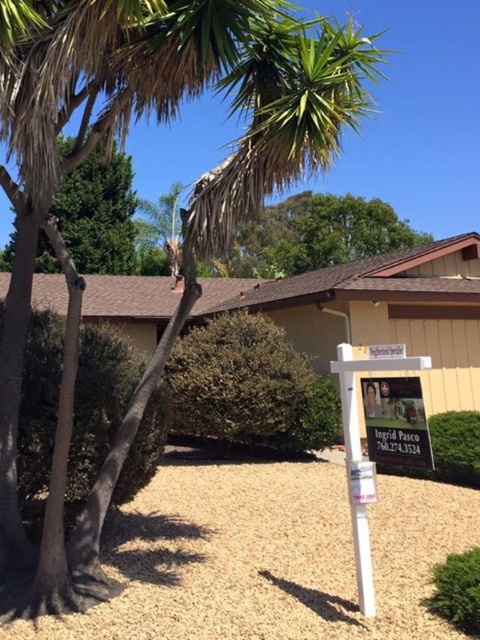
Question: Is green leafy bush at center closer to camera compared to white plastic sign at lower right?

Choices:
 (A) no
 (B) yes

Answer: (A)

Question: Which of these objects is positioned farthest from the green leafy bush at center?

Choices:
 (A) green leafy bush at lower right
 (B) green leafy tree at upper left
 (C) metallic silver sign at center
 (D) white plastic sign at lower right

Answer: (B)

Question: Estimate the real-world distances between objects in this image. Which object is closer to the green leafy bush at lower right?

Choices:
 (A) metallic silver sign at center
 (B) green leafy bush at center

Answer: (A)

Question: Among these points, which one is farthest from the camera?

Choices:
 (A) (339, 388)
 (B) (69, 458)
 (C) (111, 170)
 (D) (467, 570)

Answer: (C)

Question: Is white plastic sign at lower right smaller than green leafy bush at lower right?

Choices:
 (A) yes
 (B) no

Answer: (B)

Question: Where is green leafy bush at center located in relation to metallic silver sign at center in the image?

Choices:
 (A) above
 (B) below

Answer: (B)